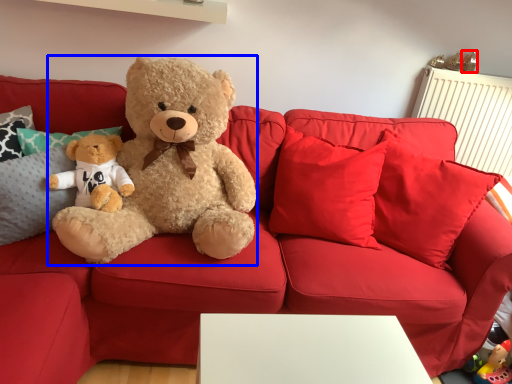
Question: Among these objects, which one is nearest to the camera, toy (highlighted by a red box) or teddy bear (highlighted by a blue box)?

Choices:
 (A) toy
 (B) teddy bear

Answer: (B)